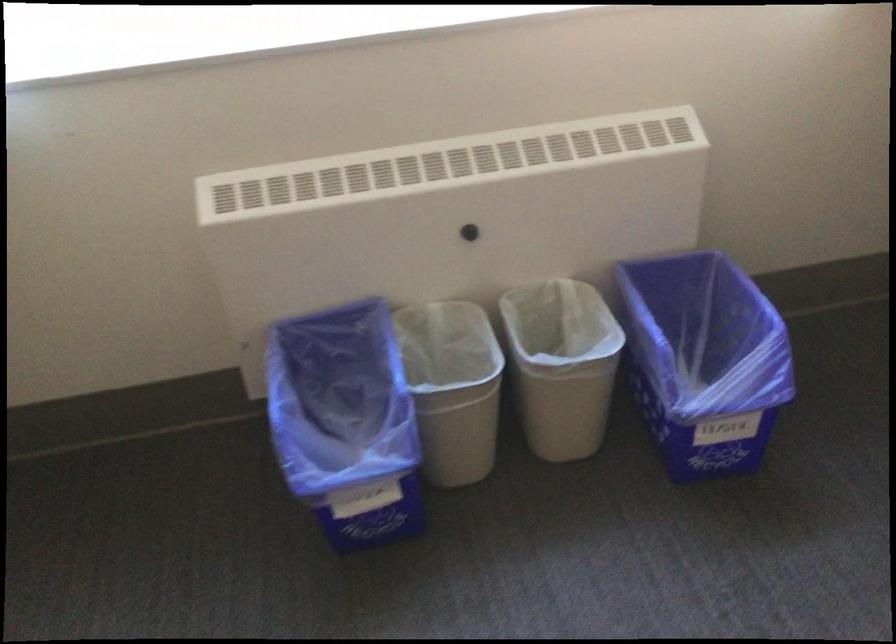
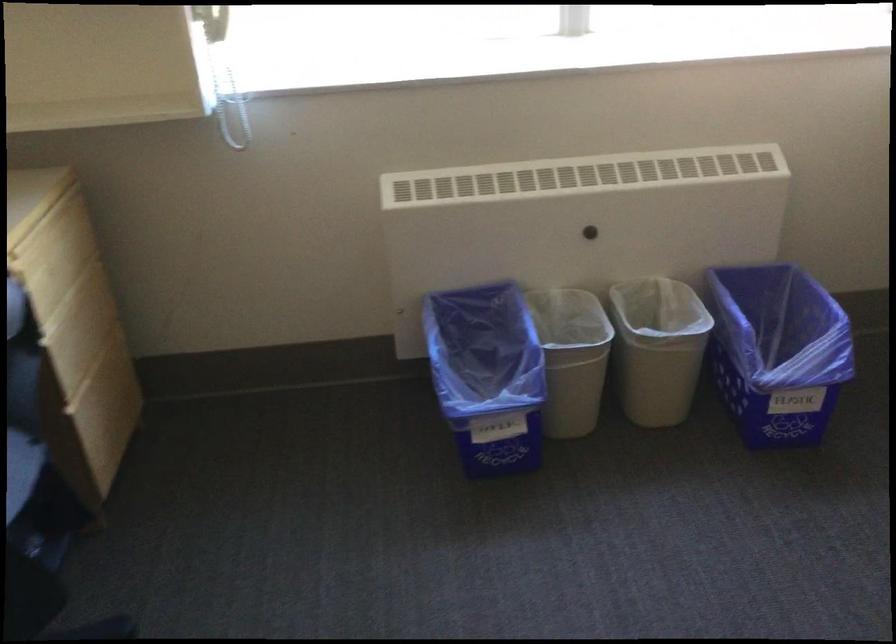
Locate, in the second image, the point that corresponds to (454,399) in the first image.

(571, 357)